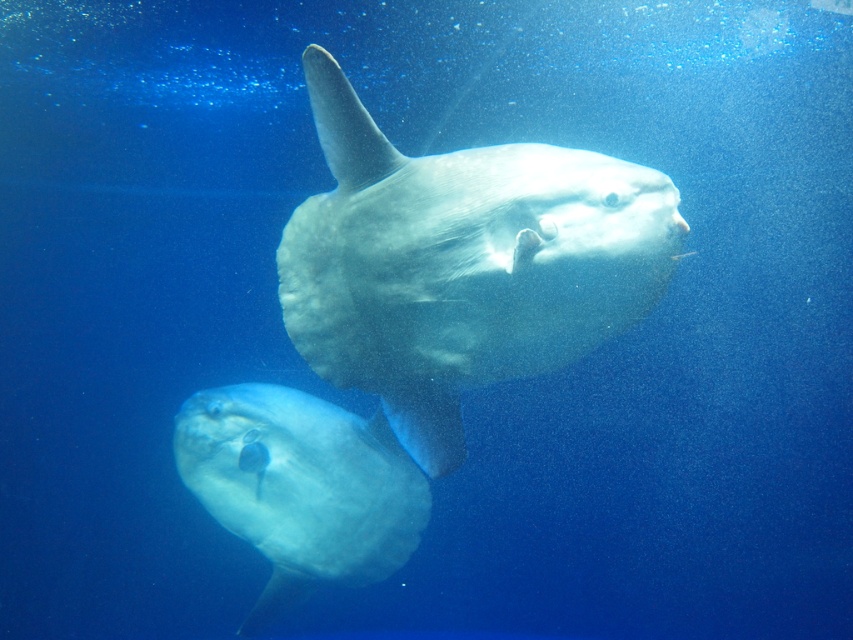
Question: Does translucent white fish at center appear over translucent rubber fish at center?

Choices:
 (A) no
 (B) yes

Answer: (B)

Question: Which point is closer to the camera taking this photo?

Choices:
 (A) (368, 506)
 (B) (558, 241)

Answer: (B)

Question: Among these points, which one is nearest to the camera?

Choices:
 (A) (340, 556)
 (B) (606, 170)

Answer: (B)

Question: Is translucent white fish at center thinner than translucent rubber fish at center?

Choices:
 (A) yes
 (B) no

Answer: (A)

Question: Is the position of translucent white fish at center less distant than that of translucent rubber fish at center?

Choices:
 (A) no
 (B) yes

Answer: (B)